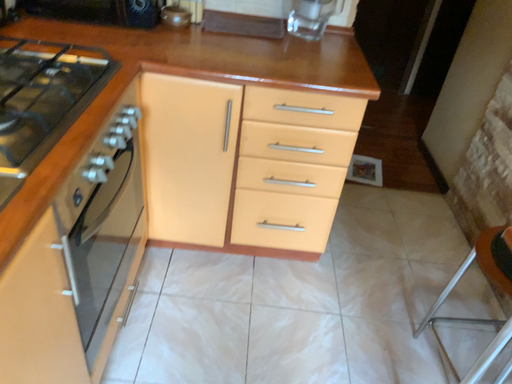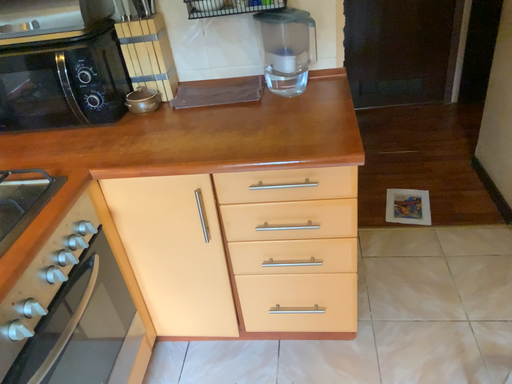
Question: Which way did the camera rotate in the video?

Choices:
 (A) rotated left
 (B) rotated right

Answer: (A)